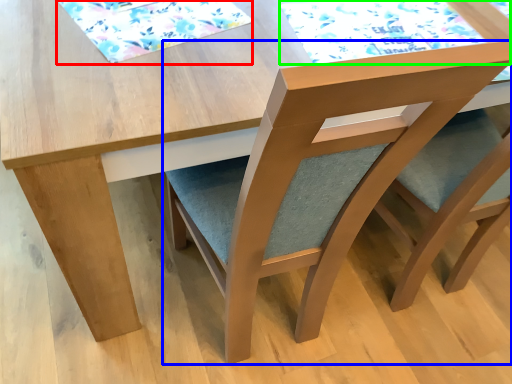
Question: Based on their relative distances, which object is nearer to mat (highlighted by a red box)? Choose from chair (highlighted by a blue box) and mat (highlighted by a green box).

Choices:
 (A) chair
 (B) mat

Answer: (B)